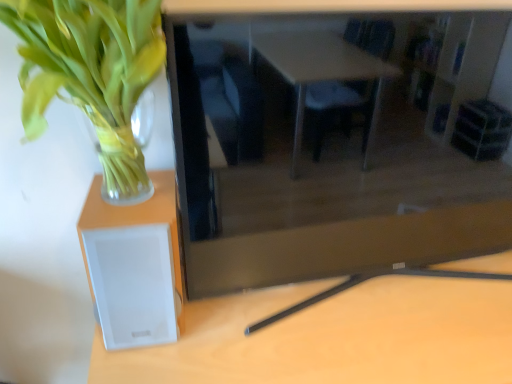
Locate an element on the screen. vacant area located to the right-hand side of white matte speaker at left is located at coordinates (234, 328).